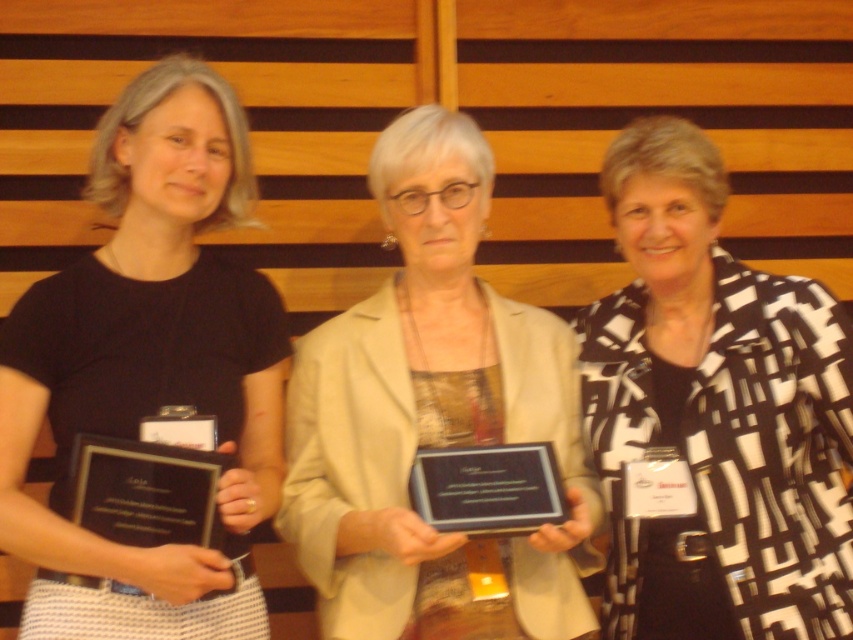
Question: Among these points, which one is farthest from the camera?

Choices:
 (A) (410, 404)
 (B) (799, 625)
 (C) (148, 520)
 (D) (485, 497)

Answer: (A)

Question: Based on their relative distances, which object is farther from the matte black shirt at left?

Choices:
 (A) black glossy plaque at center
 (B) beige fabric jacket at center
 (C) black glossy plaque at left

Answer: (A)

Question: Is matte black shirt at left positioned before black glossy plaque at left?

Choices:
 (A) no
 (B) yes

Answer: (B)

Question: Can you confirm if black and white patterned blazer at center is positioned to the left of black glossy plaque at left?

Choices:
 (A) no
 (B) yes

Answer: (A)

Question: Is black and white patterned blazer at center further to the viewer compared to matte black shirt at left?

Choices:
 (A) no
 (B) yes

Answer: (B)

Question: Which object appears farthest from the camera in this image?

Choices:
 (A) black glossy plaque at left
 (B) matte black shirt at left
 (C) beige fabric jacket at center

Answer: (A)